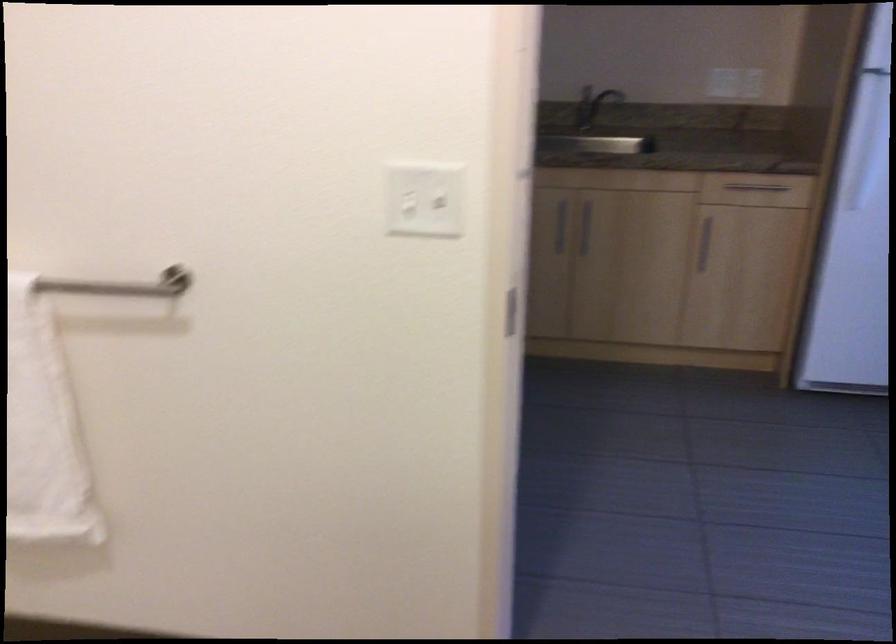
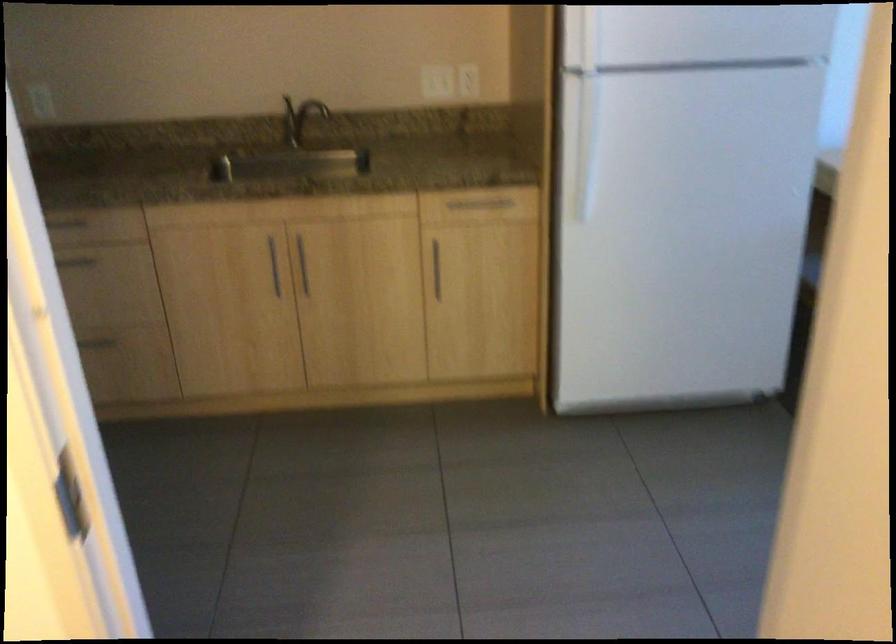
Question: The images are taken continuously from a first-person perspective. In which direction is your viewpoint rotating?

Choices:
 (A) Left
 (B) Right
 (C) Up
 (D) Down

Answer: (B)